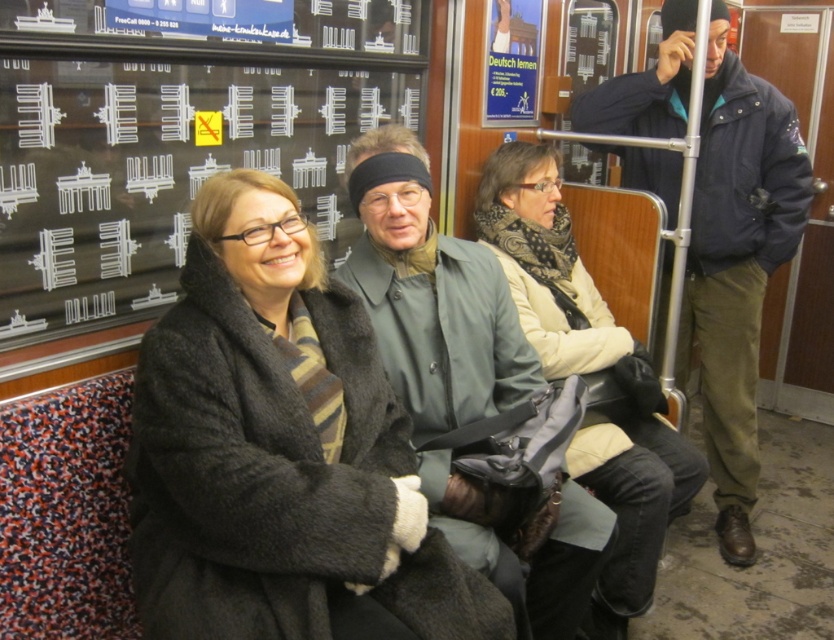
Question: Where is leather seat at center located in relation to beige fabric coat at center in the image?

Choices:
 (A) above
 (B) below

Answer: (A)

Question: Considering the real-world distances, which object is farthest from the green matte coat at center?

Choices:
 (A) beige fabric coat at center
 (B) leather seat at center
 (C) dark gray wool coat at center

Answer: (B)

Question: Among these objects, which one is farthest from the camera?

Choices:
 (A) dark gray wool coat at center
 (B) leather seat at center
 (C) green matte coat at center

Answer: (B)

Question: Does dark gray wool coat at center appear on the right side of beige fabric coat at center?

Choices:
 (A) yes
 (B) no

Answer: (B)

Question: Which point appears farthest from the camera in this image?

Choices:
 (A) (408, 458)
 (B) (501, 243)
 (C) (706, 216)

Answer: (C)

Question: Does green matte coat at center have a smaller size compared to beige fabric coat at center?

Choices:
 (A) yes
 (B) no

Answer: (A)